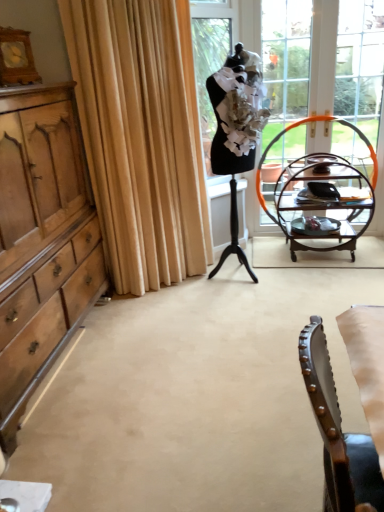
Question: Can you confirm if beige fabric curtain at left is taller than wooden desk at right?

Choices:
 (A) no
 (B) yes

Answer: (B)

Question: Considering the relative sizes of beige fabric curtain at left and wooden desk at right in the image provided, is beige fabric curtain at left bigger than wooden desk at right?

Choices:
 (A) no
 (B) yes

Answer: (B)

Question: Is beige fabric curtain at left not within wooden desk at right?

Choices:
 (A) yes
 (B) no

Answer: (A)

Question: From the image's perspective, is beige fabric curtain at left below wooden desk at right?

Choices:
 (A) yes
 (B) no

Answer: (B)

Question: Is beige fabric curtain at left further to the viewer compared to wooden desk at right?

Choices:
 (A) yes
 (B) no

Answer: (B)

Question: Considering the positions of point (110, 222) and point (66, 147), is point (110, 222) closer or farther from the camera than point (66, 147)?

Choices:
 (A) closer
 (B) farther

Answer: (B)

Question: Considering their positions, is beige fabric curtain at left located in front of or behind light brown wood cabinet at left?

Choices:
 (A) behind
 (B) front

Answer: (A)

Question: From the image's perspective, is beige fabric curtain at left located above or below light brown wood cabinet at left?

Choices:
 (A) above
 (B) below

Answer: (A)

Question: From a real-world perspective, relative to light brown wood cabinet at left, is beige fabric curtain at left vertically above or below?

Choices:
 (A) below
 (B) above

Answer: (B)

Question: In terms of width, does clear glass window at upper right look wider or thinner when compared to light brown wood cabinet at left?

Choices:
 (A) wide
 (B) thin

Answer: (B)

Question: From a real-world perspective, relative to light brown wood cabinet at left, is clear glass window at upper right vertically above or below?

Choices:
 (A) below
 (B) above

Answer: (B)

Question: From the image's perspective, is clear glass window at upper right located above or below light brown wood cabinet at left?

Choices:
 (A) above
 (B) below

Answer: (A)

Question: Considering the relative positions of clear glass window at upper right and light brown wood cabinet at left in the image provided, is clear glass window at upper right to the left or to the right of light brown wood cabinet at left?

Choices:
 (A) right
 (B) left

Answer: (A)

Question: Is point tap(342, 197) positioned closer to the camera than point tap(144, 45)?

Choices:
 (A) farther
 (B) closer

Answer: (A)

Question: Relative to beige fabric curtain at left, is wooden desk at right in front or behind?

Choices:
 (A) front
 (B) behind

Answer: (B)